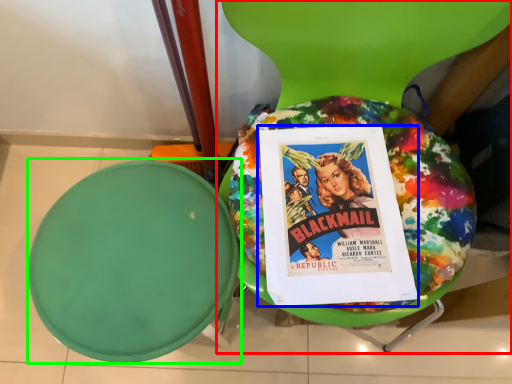
Question: Estimate the real-world distances between objects in this image. Which object is farther from chair (highlighted by a red box), comic book (highlighted by a blue box) or round table (highlighted by a green box)?

Choices:
 (A) comic book
 (B) round table

Answer: (B)